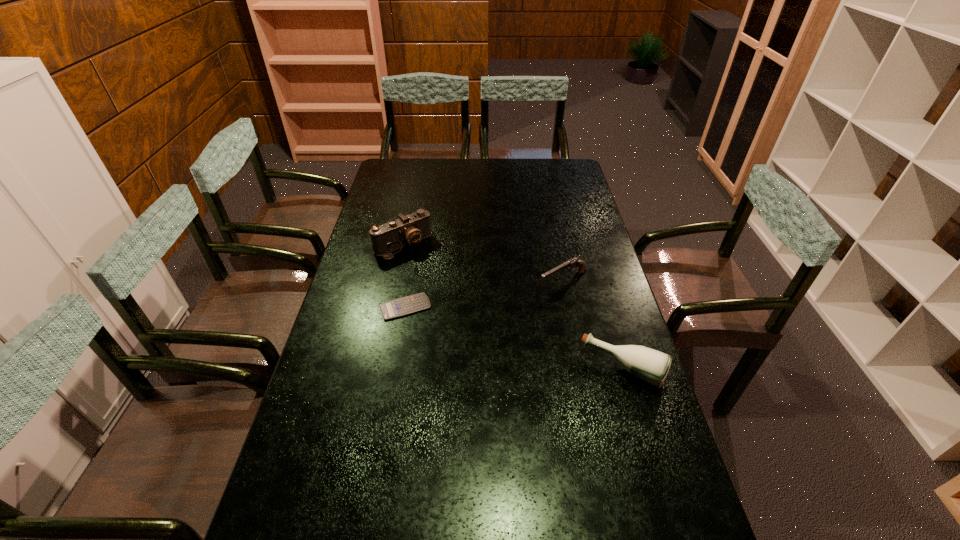
The height and width of the screenshot is (540, 960). I want to click on vacant space located 0.310m on the front-facing side of the farthest object, so click(464, 308).

You are a GUI agent. You are given a task and a screenshot of the screen. Output one action in this format:
    pyautogui.click(x=<x>, y=<y>)
    Task: Click on the free space located on the front-facing side of the farthest object
    
    Given the screenshot: What is the action you would take?
    pyautogui.click(x=457, y=301)

At what (x,y) coordinates should I click in order to perform the action: click on free point located on the front-facing side of the farthest object. Please return your answer as a coordinate pair (x, y). Looking at the image, I should click on (459, 303).

Identify the location of calculator that is at the left edge. (399, 307).

In order to click on camera that is at the left edge in this screenshot , I will do `click(408, 230)`.

Identify the location of bottle that is at the right edge. (652, 366).

Where is `gun at the right edge`? The width and height of the screenshot is (960, 540). gun at the right edge is located at coordinates (573, 262).

In the image, there is a desktop. Find the location of `free region at the far edge`. free region at the far edge is located at coordinates (486, 159).

Locate an element on the screen. Image resolution: width=960 pixels, height=540 pixels. blank space at the left edge of the desktop is located at coordinates (382, 215).

This screenshot has height=540, width=960. In the image, there is a desktop. In order to click on vacant space at the right edge in this screenshot , I will do `click(573, 207)`.